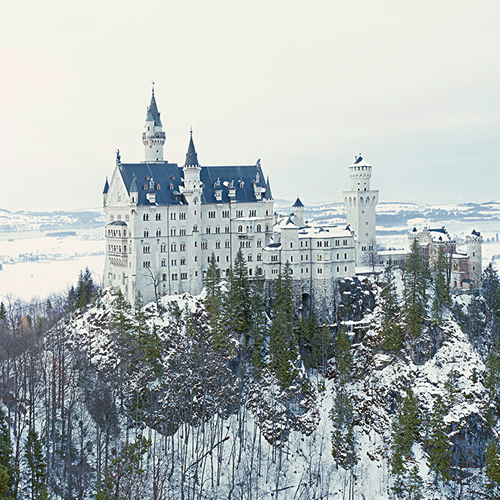
Where is `bottom right corner empty space`? The width and height of the screenshot is (500, 500). bottom right corner empty space is located at coordinates (491, 488).